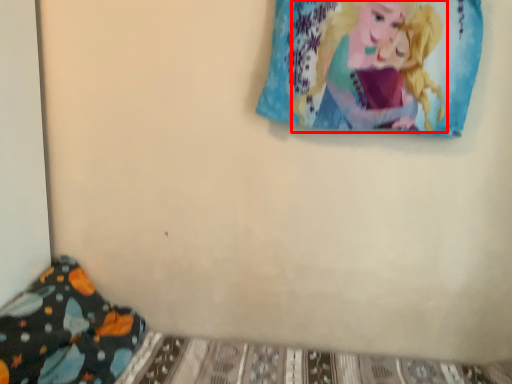
Question: Observing the image, what is the correct spatial positioning of person (annotated by the red box) in reference to pillow?

Choices:
 (A) left
 (B) right

Answer: (B)